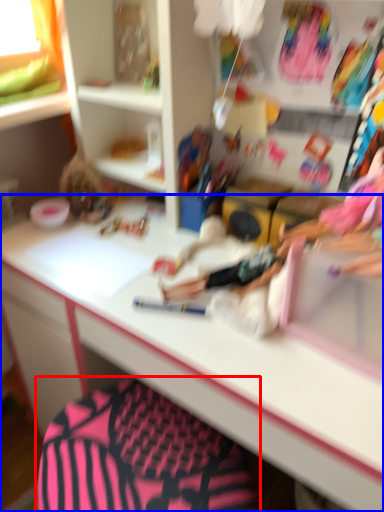
Question: Among these objects, which one is farthest to the camera, swivel chair (highlighted by a red box) or desk (highlighted by a blue box)?

Choices:
 (A) swivel chair
 (B) desk

Answer: (A)